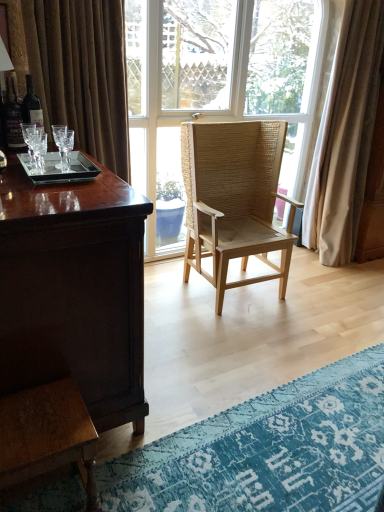
The height and width of the screenshot is (512, 384). Find the location of `free spot to the right of natural woven wood chair at center`. free spot to the right of natural woven wood chair at center is located at coordinates [x=317, y=301].